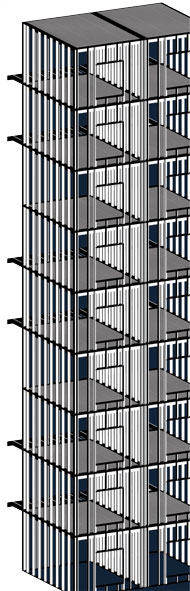
At what (x,y) coordinates should I click in order to perform the action: click on second floor rooms. Please return your answer as a coordinate pair (x, y). Looking at the image, I should click on pos(100,513), pos(163,502).